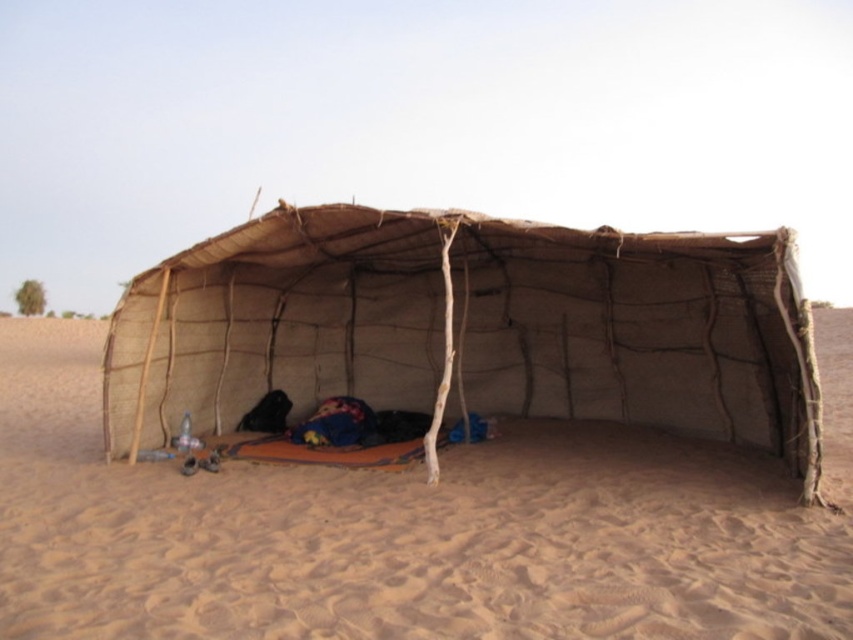
You are planning to set up a small tent that requires a 3 meter wide space. You observe the brown sandy ground at center and the natural woven fabric tent at center in the image. Which area would be suitable for your tent based on their widths?

The brown sandy ground at center might be wider than natural woven fabric tent at center, so the brown sandy ground at center would be more suitable for setting up the tent requiring a 3 meter wide space.

You are setting up a campsite in the desert and have a map showing the location of the brown sandy ground at center and the natural woven fabric tent at center. According to the map, which object is located to the left of the other?

The brown sandy ground at center is positioned on the right side of natural woven fabric tent at center, so the natural woven fabric tent at center is to the left of the brown sandy ground at center.

From the picture: You are planning to set up a tent in the desert. Based on the image, is the natural woven fabric tent at center placed on top of the brown sandy ground at center?

Yes, the natural woven fabric tent at center is placed on top of the brown sandy ground at center because the brown sandy ground at center is below natural woven fabric tent at center.